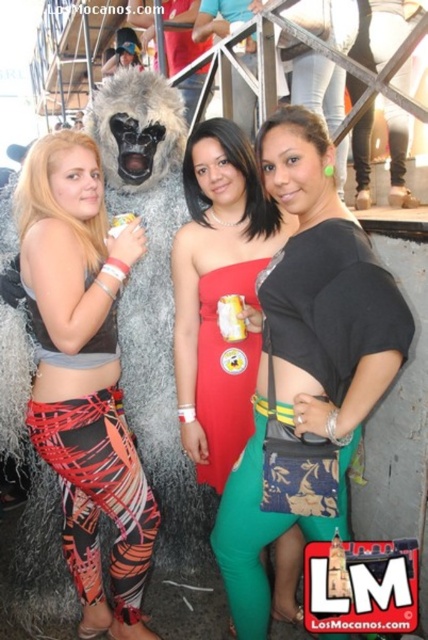
You are a photographer trying to adjust the lighting for a photo shoot. You notice the black matte top at center and the printed leggings at left. Which object is covering part of the other?

The black matte top at center is positioned over the printed leggings at left, so it is covering part of the printed leggings at left.

You are standing in the center of the scene and want to know the position of the printed leggings at left relative to your current position. Can you determine if they are to your left or right side?

The printed leggings at left is located at point [83,374], which places them to your left side.

You are a photographer trying to place a small prop at the exact location of the point labeled as point (219, 292). Based on the scene description, where should you place the prop?

The point (219, 292) is on the matte red dress at center, so you should place the prop on the matte red dress at center.